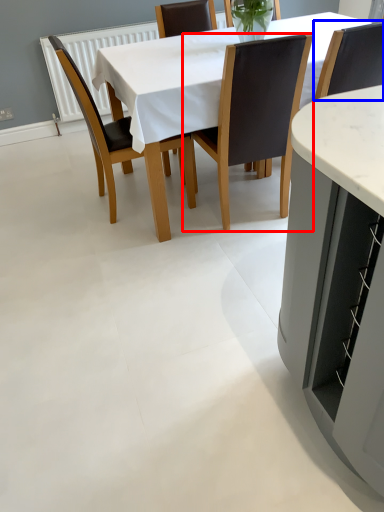
Question: Which of the following is the closest to the observer, chair (highlighted by a red box) or chair (highlighted by a blue box)?

Choices:
 (A) chair
 (B) chair

Answer: (A)